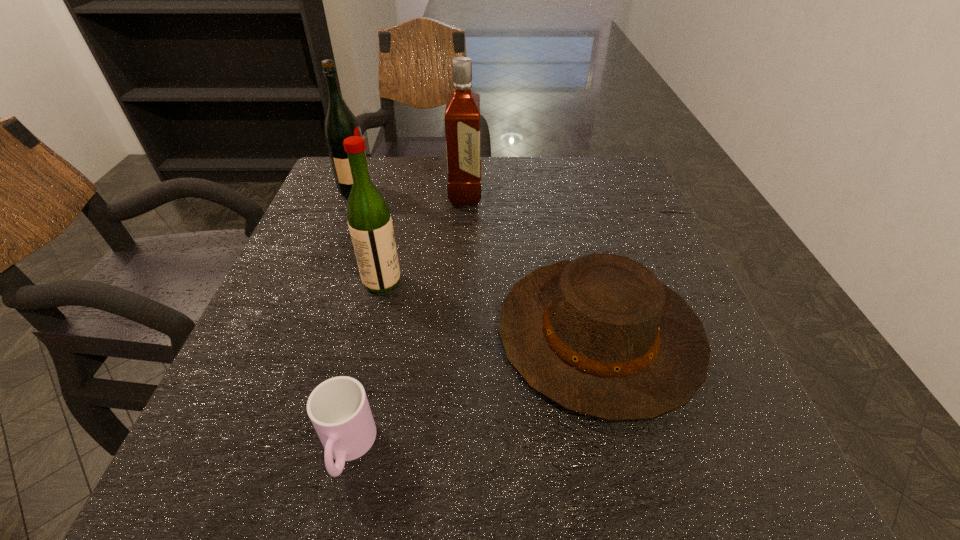
In order to click on object at the near edge in this screenshot , I will do `click(338, 408)`.

This screenshot has width=960, height=540. Find the location of `object that is positioned at the left edge`. object that is positioned at the left edge is located at coordinates (340, 123).

You are a GUI agent. You are given a task and a screenshot of the screen. Output one action in this format:
    pyautogui.click(x=<x>, y=<y>)
    Task: Click on the object positioned at the right edge
    This screenshot has height=540, width=960.
    Given the screenshot: What is the action you would take?
    pyautogui.click(x=601, y=336)

In order to click on object located in the far left corner section of the desktop in this screenshot , I will do `click(340, 123)`.

Locate an element on the screen. vacant space at the far edge of the desktop is located at coordinates (545, 157).

Locate an element on the screen. This screenshot has width=960, height=540. vacant space at the near edge is located at coordinates (x=490, y=503).

You are a GUI agent. You are given a task and a screenshot of the screen. Output one action in this format:
    pyautogui.click(x=<x>, y=<y>)
    Task: Click on the vacant space at the left edge
    This screenshot has width=960, height=540.
    Given the screenshot: What is the action you would take?
    pyautogui.click(x=214, y=404)

In the image, there is a desktop. Identify the location of vacant space at the right edge. (724, 376).

Identify the location of vacant space at the far left corner. This screenshot has width=960, height=540. (384, 170).

Identify the location of vacant space at the near left corner of the desktop. The image size is (960, 540). (191, 505).